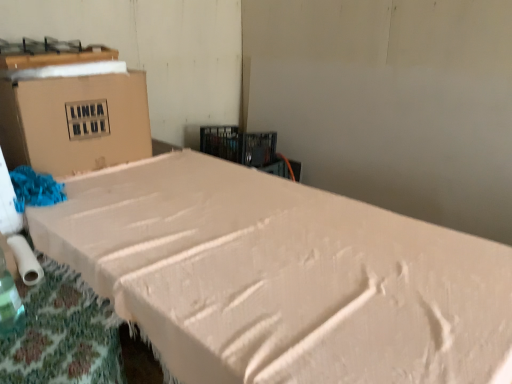
Identify the location of brown cardboard box at upper left. (75, 122).

Describe the element at coordinates (75, 122) in the screenshot. I see `brown cardboard box at upper left` at that location.

From the picture: What is the approximate width of brown cardboard box at upper left?

brown cardboard box at upper left is 13.12 inches in width.

Locate an element on the screen. The height and width of the screenshot is (384, 512). brown cardboard box at upper left is located at coordinates (75, 122).